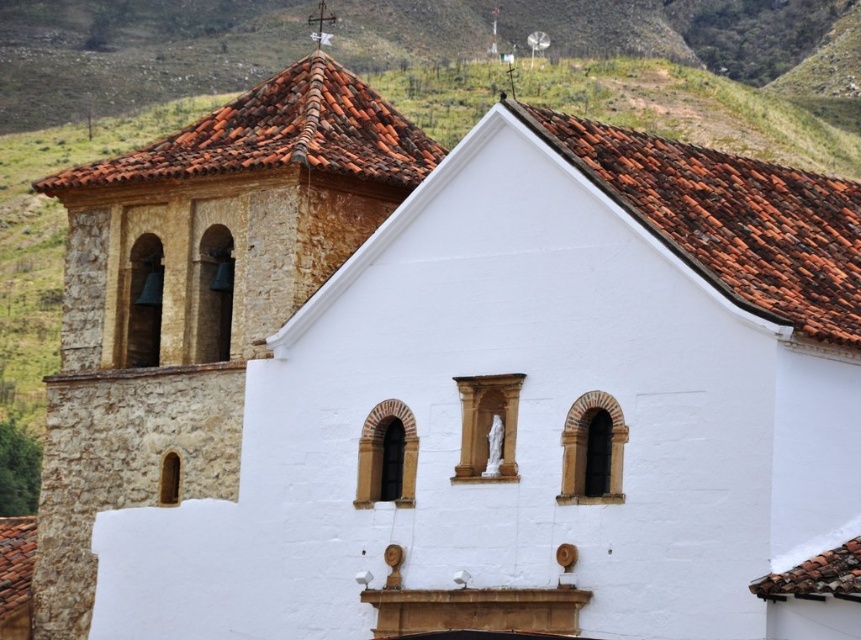
You are an architect inspecting the roof of the church. You notice two sections of terracotta tiles at upper center and terracotta tiles at upper left. Which section has a lower height?

The terracotta tiles at upper center is shorter than the terracotta tiles at upper left, so the section at upper center has a lower height.

You are an architect examining the roof details of the church. You notice the brown clay tiles at upper center and the terracotta tiles at upper left. Which of these two tiles is positioned more to the east side of the roof?

The terracotta tiles at upper left are positioned more to the east side of the roof because the brown clay tiles at upper center is to the right of them, meaning the terracotta tiles are on the left side which would be east if the image is oriented with right as west.

Consider the image. You are standing in front of the church and want to locate the point marked at coordinates (729, 220). Based on the scene description, where would this point be located in relation to the bell tower and the roof tiles?

The point at coordinates (729, 220) is located on the terracotta tiles at the upper center of the roof. Since the bell tower is on the left side of the image, the point would be to the right of the bell tower, positioned near the curved edge of the roof tiles.